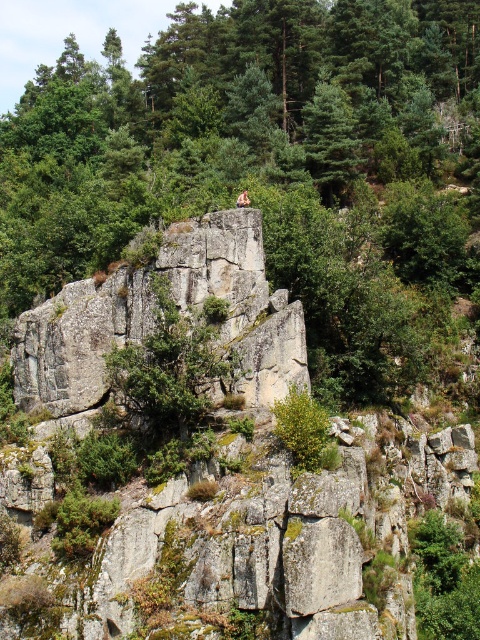
Question: Considering the relative positions of green leafy tree at upper center and tan skin rock climber at center in the image provided, where is green leafy tree at upper center located with respect to tan skin rock climber at center?

Choices:
 (A) below
 (B) above

Answer: (B)

Question: In this image, where is green leafy tree at upper center located relative to tan skin rock climber at center?

Choices:
 (A) right
 (B) left

Answer: (B)

Question: Among these points, which one is farthest from the camera?

Choices:
 (A) (236, 204)
 (B) (446, 244)

Answer: (B)

Question: Can you confirm if green leafy tree at upper center is wider than tan skin rock climber at center?

Choices:
 (A) no
 (B) yes

Answer: (B)